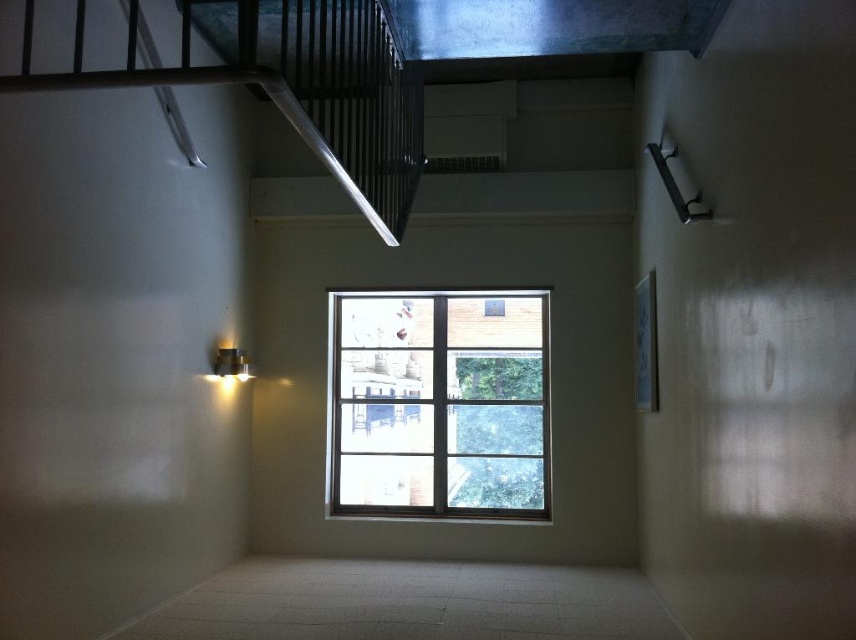
Can you confirm if metallic silver stair at upper left is smaller than matte silver light fixture at left?

No, metallic silver stair at upper left is not smaller than matte silver light fixture at left.

Is metallic silver stair at upper left to the right of matte silver light fixture at left from the viewer's perspective?

Yes, metallic silver stair at upper left is to the right of matte silver light fixture at left.

The height and width of the screenshot is (640, 856). Describe the element at coordinates (327, 88) in the screenshot. I see `metallic silver stair at upper left` at that location.

I want to click on metallic silver stair at upper left, so click(x=327, y=88).

Is clear glass window at center further to the viewer compared to matte silver light fixture at left?

Yes, it is.

Between clear glass window at center and matte silver light fixture at left, which one has less height?

matte silver light fixture at left

Who is more distant from viewer, (372, 403) or (220, 355)?

Positioned behind is point (372, 403).

Locate an element on the screen. The height and width of the screenshot is (640, 856). clear glass window at center is located at coordinates (440, 403).

Who is taller, clear glass window at center or metallic silver stair at upper left?

Standing taller between the two is metallic silver stair at upper left.

Is clear glass window at center wider than metallic silver stair at upper left?

Indeed, clear glass window at center has a greater width compared to metallic silver stair at upper left.

Between point (440, 330) and point (187, 64), which one is positioned in front?

Point (187, 64)

At what (x,y) coordinates should I click in order to perform the action: click on clear glass window at center. Please return your answer as a coordinate pair (x, y). Looking at the image, I should click on (440, 403).